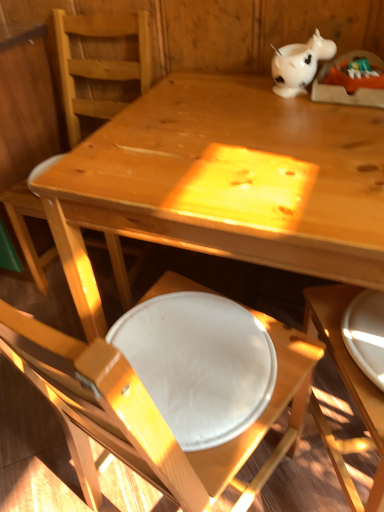
Question: Is white glossy plate at lower right wider than matte wood chair at center, which ranks as the first chair in back-to-front order?

Choices:
 (A) no
 (B) yes

Answer: (A)

Question: Would you say white glossy plate at lower right contains matte wood chair at center, which ranks as the first chair in back-to-front order?

Choices:
 (A) yes
 (B) no

Answer: (B)

Question: Would you consider white glossy plate at lower right to be distant from matte wood chair at center, which is counted as the 2th chair, starting from the front?

Choices:
 (A) yes
 (B) no

Answer: (A)

Question: From a real-world perspective, does white glossy plate at lower right sit lower than matte wood chair at center, which ranks as the first chair in back-to-front order?

Choices:
 (A) yes
 (B) no

Answer: (B)

Question: Does white glossy plate at lower right come in front of matte wood chair at center, which is counted as the 2th chair, starting from the front?

Choices:
 (A) yes
 (B) no

Answer: (A)

Question: From the image's perspective, would you say white glossy plate at lower right is shown under matte wood chair at center, which is counted as the 2th chair, starting from the front?

Choices:
 (A) yes
 (B) no

Answer: (A)

Question: From the image's perspective, does matte wood chair at center, which is counted as the 2th chair, starting from the front, appear lower than white glossy piggy bank at upper right?

Choices:
 (A) no
 (B) yes

Answer: (B)

Question: Can you confirm if matte wood chair at center, which is counted as the 2th chair, starting from the front, is thinner than white glossy piggy bank at upper right?

Choices:
 (A) no
 (B) yes

Answer: (A)

Question: Is white glossy piggy bank at upper right completely or partially inside matte wood chair at center, which ranks as the first chair in back-to-front order?

Choices:
 (A) yes
 (B) no

Answer: (B)

Question: Does matte wood chair at center, which is counted as the 2th chair, starting from the front, touch white glossy piggy bank at upper right?

Choices:
 (A) yes
 (B) no

Answer: (B)

Question: Can you confirm if matte wood chair at center, which is counted as the 2th chair, starting from the front, is positioned to the right of white glossy piggy bank at upper right?

Choices:
 (A) yes
 (B) no

Answer: (B)

Question: From a real-world perspective, is matte wood chair at center, which ranks as the first chair in back-to-front order, located beneath white glossy piggy bank at upper right?

Choices:
 (A) no
 (B) yes

Answer: (B)

Question: Can you confirm if white glossy piggy bank at upper right is positioned to the left of white glossy plate at lower right?

Choices:
 (A) no
 (B) yes

Answer: (B)